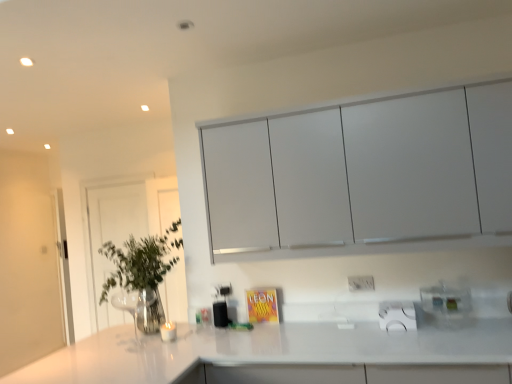
Identify the location of vacant area on top of clear glass door at left (from a real-world perspective). (115, 182).